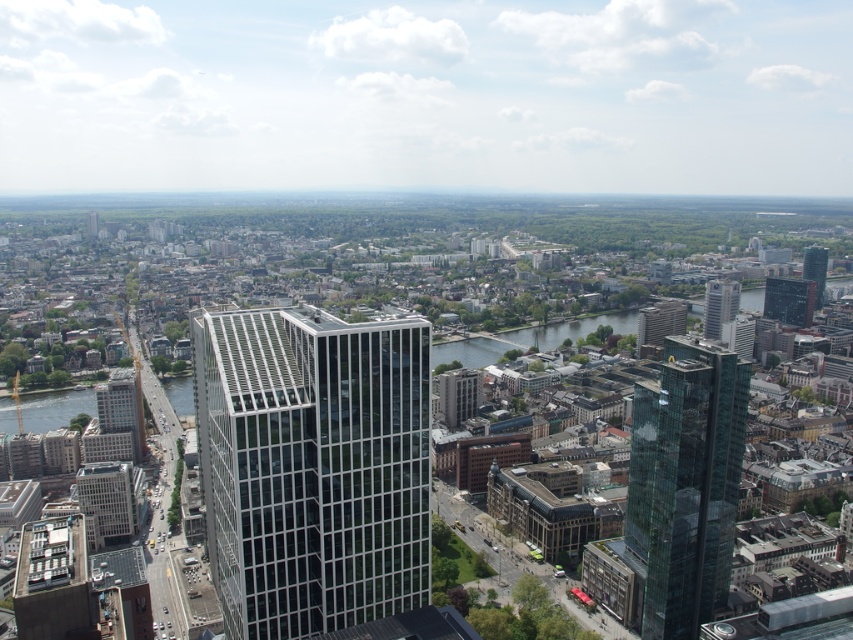
Question: Observing the image, what is the correct spatial positioning of transparent glass skyscraper at right in reference to glassy silver skyscraper at center-right?

Choices:
 (A) right
 (B) left

Answer: (B)

Question: From the image, what is the correct spatial relationship of glassy silver skyscraper at center-right in relation to green glass skyscraper at center?

Choices:
 (A) above
 (B) below

Answer: (B)

Question: Which object is positioned closest to the green glass skyscraper at center?

Choices:
 (A) transparent glass skyscraper at right
 (B) matte glass skyscraper at center
 (C) glassy silver skyscraper at center-right

Answer: (C)

Question: Which point is closer to the camera?

Choices:
 (A) (802, 276)
 (B) (698, 429)

Answer: (B)

Question: In this image, where is matte glass skyscraper at center located relative to transparent glass skyscraper at right?

Choices:
 (A) right
 (B) left

Answer: (B)

Question: Which object appears farthest from the camera in this image?

Choices:
 (A) transparent glass skyscraper at right
 (B) matte glass skyscraper at center
 (C) green glass skyscraper at center

Answer: (C)